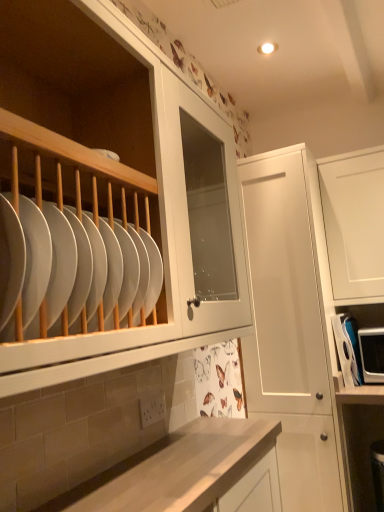
Question: Is white plastic microwave at right bigger than white glossy plate at left?

Choices:
 (A) yes
 (B) no

Answer: (B)

Question: Is white glossy plate at left located within white plastic microwave at right?

Choices:
 (A) no
 (B) yes

Answer: (A)

Question: From the image's perspective, would you say white plastic microwave at right is shown under white glossy plate at left?

Choices:
 (A) no
 (B) yes

Answer: (B)

Question: Is white plastic microwave at right outside white glossy plate at left?

Choices:
 (A) no
 (B) yes

Answer: (B)

Question: From a real-world perspective, is white plastic microwave at right on white glossy plate at left?

Choices:
 (A) no
 (B) yes

Answer: (A)

Question: Based on their positions, is white glossy plate at left located to the left or right of white matte cabinet at center?

Choices:
 (A) left
 (B) right

Answer: (A)

Question: Based on their sizes in the image, would you say white glossy plate at left is bigger or smaller than white matte cabinet at center?

Choices:
 (A) small
 (B) big

Answer: (A)

Question: Is white glossy plate at left taller or shorter than white matte cabinet at center?

Choices:
 (A) short
 (B) tall

Answer: (A)

Question: From the image's perspective, is white glossy plate at left positioned above or below white matte cabinet at center?

Choices:
 (A) below
 (B) above

Answer: (B)

Question: Relative to white plastic microwave at right, is white matte cabinet at center in front or behind?

Choices:
 (A) behind
 (B) front

Answer: (B)

Question: Considering the positions of point (326, 419) and point (340, 315), is point (326, 419) closer or farther from the camera than point (340, 315)?

Choices:
 (A) closer
 (B) farther

Answer: (A)

Question: Would you say white matte cabinet at center is to the left or to the right of white plastic microwave at right in the picture?

Choices:
 (A) left
 (B) right

Answer: (A)

Question: From the image's perspective, is white matte cabinet at center above or below white plastic microwave at right?

Choices:
 (A) above
 (B) below

Answer: (B)

Question: Considering the positions of white plastic microwave at right and white glossy plate at left in the image, is white plastic microwave at right taller or shorter than white glossy plate at left?

Choices:
 (A) short
 (B) tall

Answer: (B)

Question: Looking at their shapes, would you say white plastic microwave at right is wider or thinner than white glossy plate at left?

Choices:
 (A) thin
 (B) wide

Answer: (B)